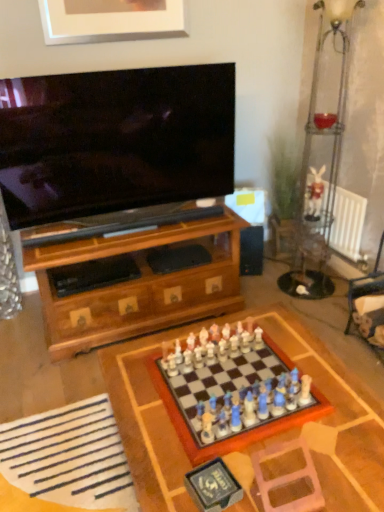
I want to click on free space to the back side of pink plastic swivel chair at lower right, which appears as the second swivel chair when viewed from the back, so click(286, 451).